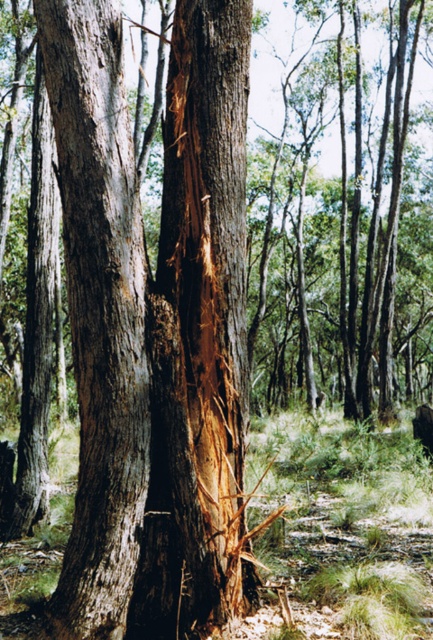
You are a hiker carrying a 3.5 meter long ladder. You want to place the ladder between yourself and the brown rough bark tree trunk at center. Is the distance sufficient to fit the ladder?

The distance between you and the brown rough bark tree trunk at center is 4.00 meters, which is greater than the ladder length of 3.5 meters. Therefore, the ladder can be placed between you and the brown rough bark tree trunk at center.

You are a forest ranger assessing the health of two tree trunks at the center of the forest. You notice the brown rough bark tree trunk at center and the smooth brown bark at center. Based on their positions, which tree trunk is closer to the ground?

The smooth brown bark at center is closer to the ground because it is located below the brown rough bark tree trunk at center.

You are a botanist examining two tree trunks in a forest. You see the brown rough bark tree trunk at center and the smooth brown bark at center. Which of these two trunks is located to the right?

The brown rough bark tree trunk at center is positioned on the right side of smooth brown bark at center, so it is located to the right.